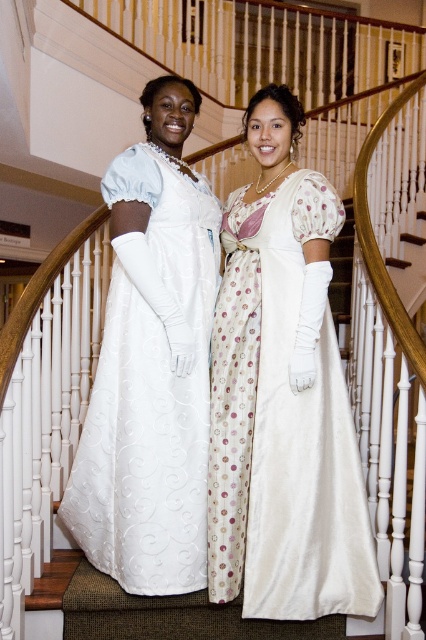
Question: Which point is farther to the camera?

Choices:
 (A) white satin dress at center
 (B) silky white gown at center

Answer: (A)

Question: Among these objects, which one is nearest to the camera?

Choices:
 (A) white satin dress at center
 (B) silky white gown at center

Answer: (B)

Question: Is silky white gown at center to the right of white satin dress at center from the viewer's perspective?

Choices:
 (A) yes
 (B) no

Answer: (A)

Question: Which of the following is the farthest from the observer?

Choices:
 (A) (190, 456)
 (B) (256, 280)

Answer: (B)

Question: Does silky white gown at center have a greater width compared to white satin dress at center?

Choices:
 (A) no
 (B) yes

Answer: (A)

Question: Is silky white gown at center to the left of white satin dress at center from the viewer's perspective?

Choices:
 (A) no
 (B) yes

Answer: (A)